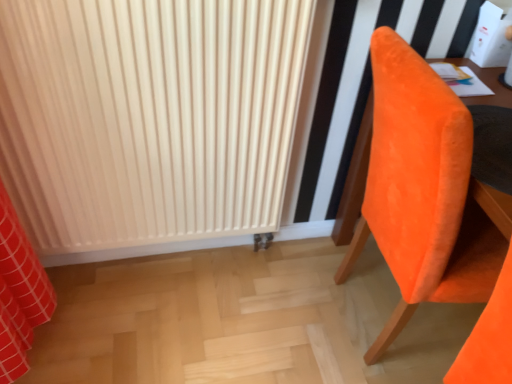
Question: From a real-world perspective, is matte white radiator at center on orange velvet chair at right?

Choices:
 (A) no
 (B) yes

Answer: (B)

Question: Considering the relative sizes of matte white radiator at center and orange velvet chair at right in the image provided, is matte white radiator at center taller than orange velvet chair at right?

Choices:
 (A) no
 (B) yes

Answer: (B)

Question: Is matte white radiator at center behind orange velvet chair at right?

Choices:
 (A) no
 (B) yes

Answer: (B)

Question: Is matte white radiator at center wider than orange velvet chair at right?

Choices:
 (A) no
 (B) yes

Answer: (A)

Question: Is matte white radiator at center directly adjacent to orange velvet chair at right?

Choices:
 (A) no
 (B) yes

Answer: (A)

Question: Could you tell me if matte white radiator at center is turned towards orange velvet chair at right?

Choices:
 (A) no
 (B) yes

Answer: (A)

Question: From a real-world perspective, is orange velvet chair at right below matte white radiator at center?

Choices:
 (A) no
 (B) yes

Answer: (B)

Question: Is orange velvet chair at right in contact with matte white radiator at center?

Choices:
 (A) no
 (B) yes

Answer: (A)

Question: Are orange velvet chair at right and matte white radiator at center far apart?

Choices:
 (A) no
 (B) yes

Answer: (A)

Question: Is orange velvet chair at right bigger than matte white radiator at center?

Choices:
 (A) no
 (B) yes

Answer: (B)

Question: Does orange velvet chair at right have a greater height compared to matte white radiator at center?

Choices:
 (A) yes
 (B) no

Answer: (B)

Question: Can you confirm if orange velvet chair at right is smaller than matte white radiator at center?

Choices:
 (A) yes
 (B) no

Answer: (B)

Question: Choose the correct answer: Is matte white radiator at center inside orange velvet chair at right or outside it?

Choices:
 (A) inside
 (B) outside

Answer: (B)